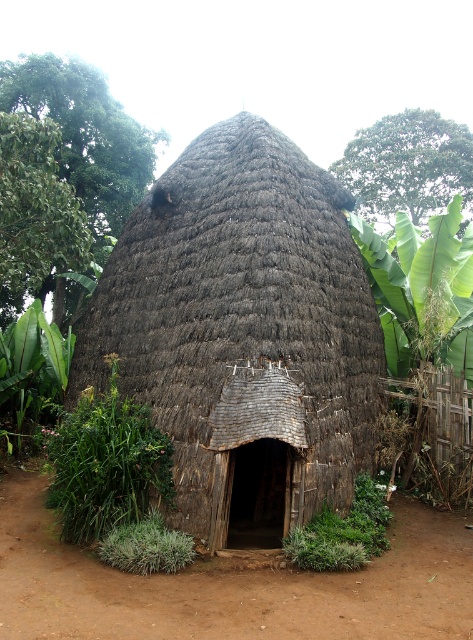
You are standing in front of the thatched roof hut and see two points marked in the scene. Which point is closer to you, point (285, 230) or point (137, 541)?

Point (137, 541) is closer to you because it is less further to the viewer than point (285, 230).

You are a delivery person carrying a package that is 3 meters long. You need to move it from the green leafy plant at lower left to the brown thatch hut at center. Is there enough space to move the package without bending it?

The distance between the brown thatch hut at center and the green leafy plant at lower left is 2.77 meters. Since the package is 3 meters long, it is longer than the available space, so you cannot move it without bending it.